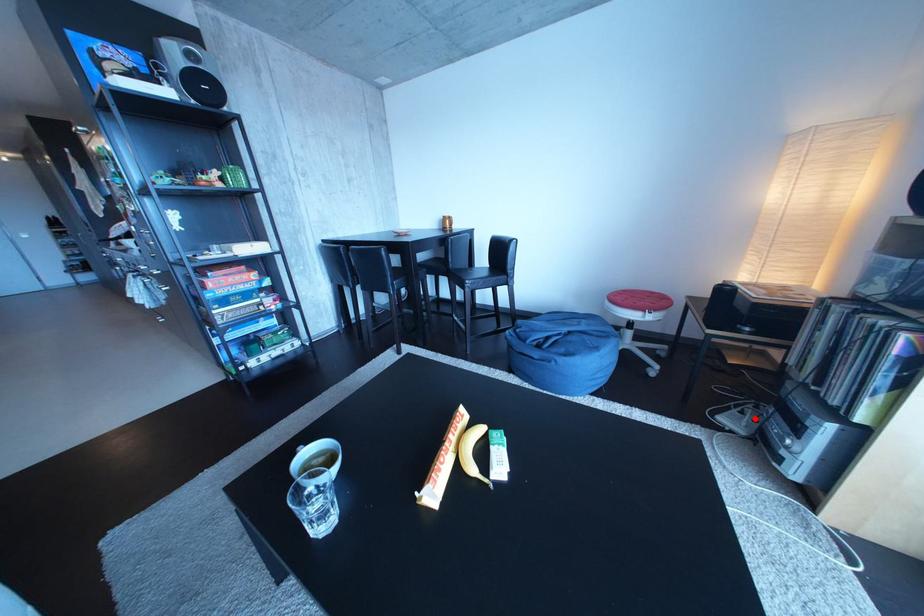
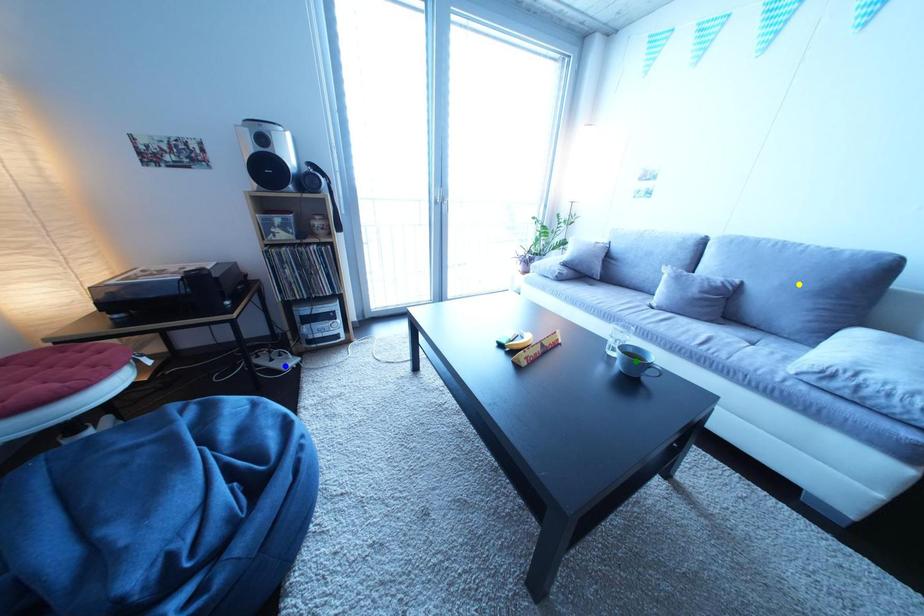
Question: I am providing you with two images of the same scene from different viewpoints. A red point is marked on the first image. You are given multiple points on the second image. Which point in image 2 represents the same 3d spot as the red point in image 1?

Choices:
 (A) yellow point
 (B) green point
 (C) blue point

Answer: (C)